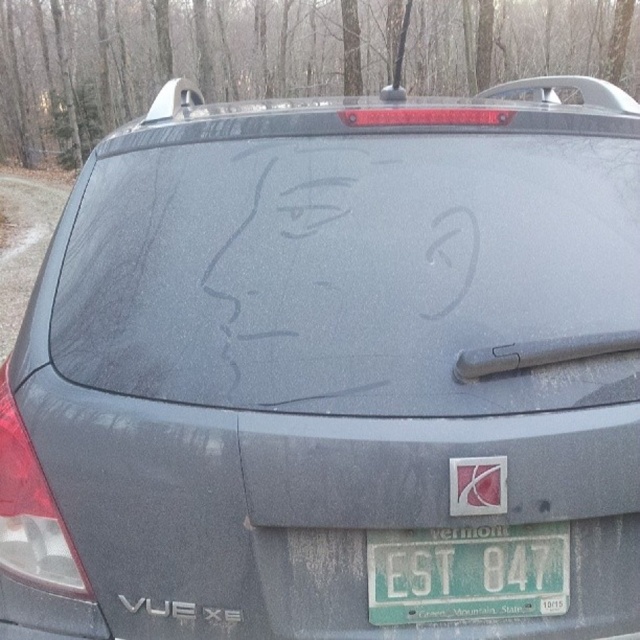
Is frosted glass drawing at center to the left of green matte license plate at lower center from the viewer's perspective?

Yes, frosted glass drawing at center is to the left of green matte license plate at lower center.

The image size is (640, 640). What do you see at coordinates (353, 272) in the screenshot?
I see `frosted glass drawing at center` at bounding box center [353, 272].

The height and width of the screenshot is (640, 640). I want to click on frosted glass drawing at center, so click(x=353, y=272).

Does green matte license plate at lower center appear over matte plastic sticker at center?

Incorrect, green matte license plate at lower center is not positioned above matte plastic sticker at center.

Does green matte license plate at lower center appear on the right side of matte plastic sticker at center?

Incorrect, green matte license plate at lower center is not on the right side of matte plastic sticker at center.

Measure the distance between point (387, 548) and camera.

Point (387, 548) is 5.62 feet away from camera.

Identify the location of green matte license plate at lower center. The image size is (640, 640). (467, 573).

Describe the element at coordinates (353, 272) in the screenshot. I see `frosted glass drawing at center` at that location.

Does frosted glass drawing at center appear under matte plastic sticker at center?

No, frosted glass drawing at center is not below matte plastic sticker at center.

Is point (456, 134) less distant than point (483, 509)?

That is False.

Locate an element on the screen. The width and height of the screenshot is (640, 640). frosted glass drawing at center is located at coordinates (353, 272).